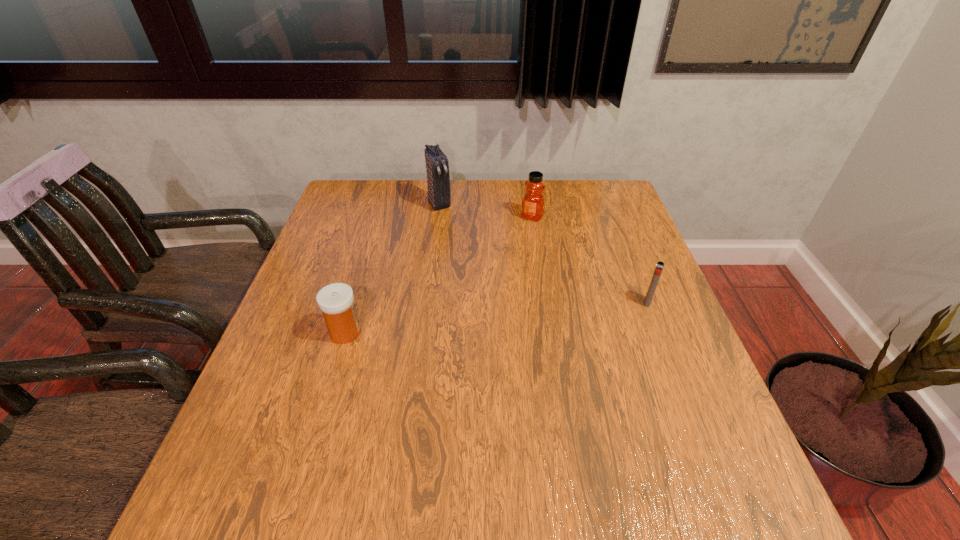
Identify the location of vacant area that lies between the medicine and the honey. The height and width of the screenshot is (540, 960). (439, 274).

Identify the location of free area in between the second object from right to left and the third object from right to left. The width and height of the screenshot is (960, 540). (486, 210).

What are the coordinates of `empty space between the leftmost object and the tallest object` in the screenshot? It's located at (393, 268).

Locate an element on the screen. This screenshot has height=540, width=960. unoccupied area between the igniter and the third shortest object is located at coordinates (589, 260).

What are the coordinates of `free space between the third object from left to right and the second object from left to right` in the screenshot? It's located at (486, 210).

Locate an element on the screen. vacant space that's between the rightmost object and the second object from left to right is located at coordinates (543, 253).

You are a GUI agent. You are given a task and a screenshot of the screen. Output one action in this format:
    pyautogui.click(x=<x>, y=<y>)
    Task: Click on the vacant space that's between the leftmost object and the clutch bag
    
    Given the screenshot: What is the action you would take?
    pyautogui.click(x=393, y=268)

This screenshot has width=960, height=540. I want to click on the third closest object to the tallest object, so click(x=659, y=267).

Locate which object is the closest to the clutch bag. Please provide its 2D coordinates. Your answer should be formatted as a tuple, i.e. [(x, y)], where the tuple contains the x and y coordinates of a point satisfying the conditions above.

[(533, 201)]

The image size is (960, 540). I want to click on vacant space that satisfies the following two spatial constraints: 1. on the front side of the second tallest object; 2. on the left side of the clutch bag, so click(x=438, y=217).